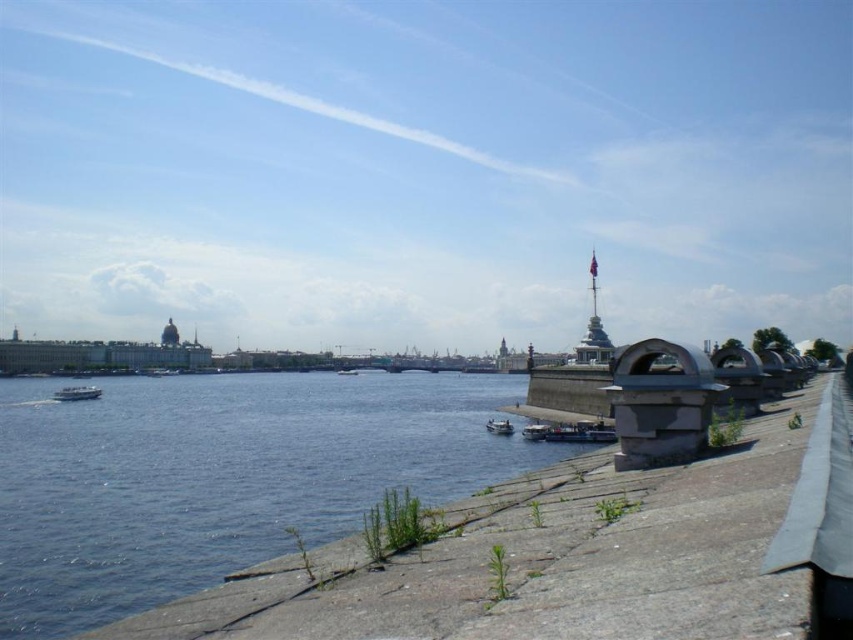
Question: Which of the following is the farthest from the observer?

Choices:
 (A) white glossy boat at center
 (B) metallic silver boat at center
 (C) white glossy boat at left

Answer: (A)

Question: Does blue water at lower left have a larger size compared to metallic blue boat at lower center?

Choices:
 (A) yes
 (B) no

Answer: (A)

Question: Is blue water at lower left further to camera compared to white glossy boat at left?

Choices:
 (A) no
 (B) yes

Answer: (A)

Question: Which object is farther from the camera taking this photo?

Choices:
 (A) white glossy boat at center
 (B) metallic silver boat at center
 (C) blue water at lower left
 (D) white glossy boat at left

Answer: (A)

Question: Based on their relative distances, which object is nearer to the metallic blue boat at lower center?

Choices:
 (A) white glossy boat at center
 (B) blue water at lower left

Answer: (B)

Question: Can you confirm if white glossy boat at left is positioned to the left of metallic blue boat at lower center?

Choices:
 (A) no
 (B) yes

Answer: (B)